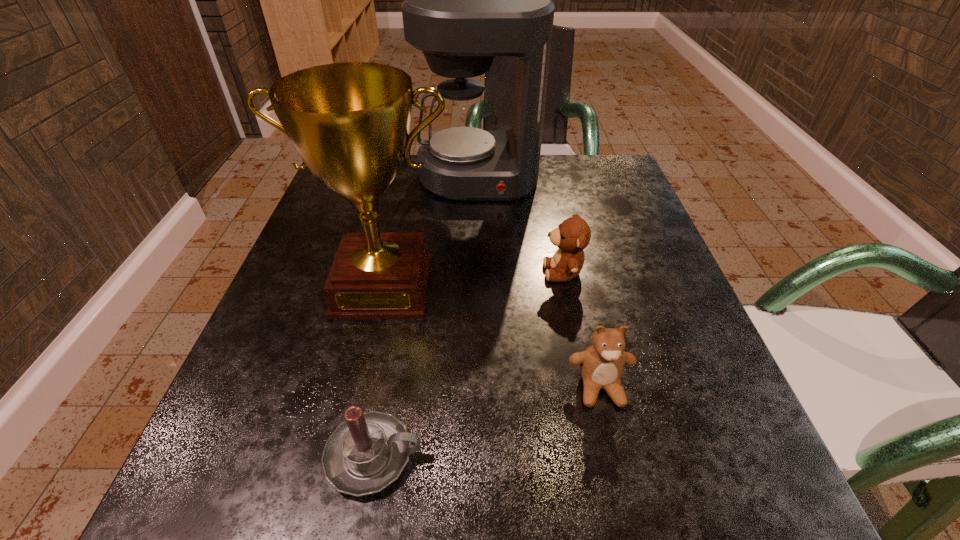
What are the coordinates of `vacant space situated 0.100m on the front-facing side of the nearer teddy bear` in the screenshot? It's located at (622, 486).

This screenshot has width=960, height=540. What are the coordinates of `free location located 0.390m on the side of the nearest object with the handle loop` in the screenshot? It's located at (732, 456).

Where is `object that is at the far edge`? object that is at the far edge is located at coordinates pos(466,0).

The width and height of the screenshot is (960, 540). I want to click on object that is at the near edge, so click(x=366, y=453).

I want to click on award present at the left edge, so click(x=349, y=122).

Find the location of a particular element. Image resolution: width=960 pixels, height=540 pixels. candle situated at the left edge is located at coordinates (366, 453).

Image resolution: width=960 pixels, height=540 pixels. Identify the location of object located at the near left corner. (366, 453).

The image size is (960, 540). I want to click on free location at the far edge of the desktop, so pos(544,188).

Find the location of `vacant region at the left edge of the desktop`. vacant region at the left edge of the desktop is located at coordinates (326, 274).

In the image, there is a desktop. What are the coordinates of `vacant space at the right edge` in the screenshot? It's located at (640, 213).